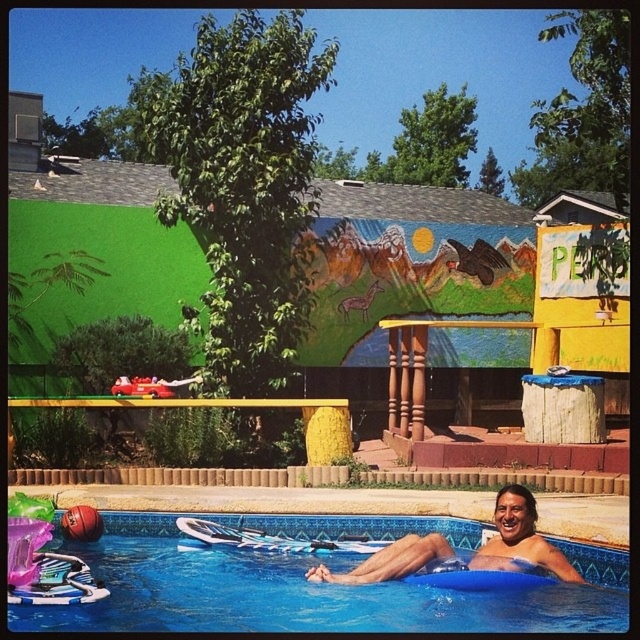
Question: Can you confirm if blue plastic pool at lower center is positioned below smooth tan skin at lower center?

Choices:
 (A) no
 (B) yes

Answer: (B)

Question: Is blue plastic pool at lower center positioned before smooth tan skin at lower center?

Choices:
 (A) yes
 (B) no

Answer: (A)

Question: In this image, where is blue plastic pool at lower center located relative to smooth tan skin at lower center?

Choices:
 (A) above
 (B) below

Answer: (B)